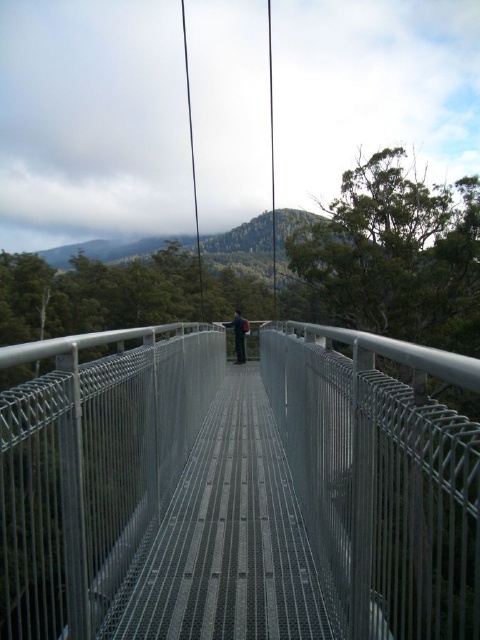
Question: Does metallic gray bridge at center have a lesser width compared to black fabric backpack at center?

Choices:
 (A) no
 (B) yes

Answer: (A)

Question: Which point is farther to the camera?

Choices:
 (A) metallic gray bridge at center
 (B) black fabric backpack at center

Answer: (B)

Question: Does metallic gray bridge at center lie in front of black fabric backpack at center?

Choices:
 (A) yes
 (B) no

Answer: (A)

Question: Can you confirm if metallic gray bridge at center is positioned above black fabric backpack at center?

Choices:
 (A) no
 (B) yes

Answer: (A)